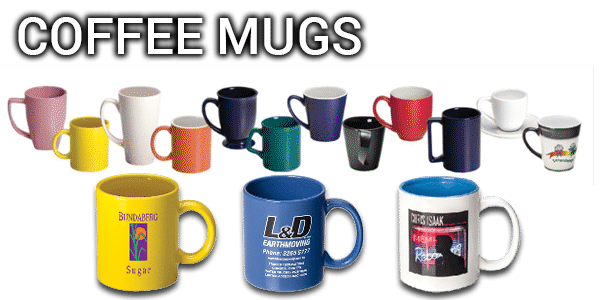
The width and height of the screenshot is (600, 300). What are the coordinates of `orange mug` in the screenshot? It's located at (198, 160).